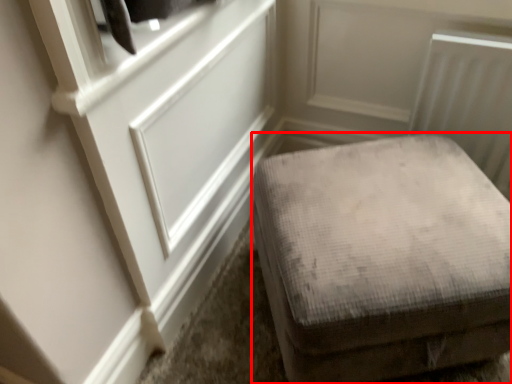
Question: From the image, what is the correct spatial relationship of furniture (annotated by the red box) in relation to door?

Choices:
 (A) left
 (B) right

Answer: (B)